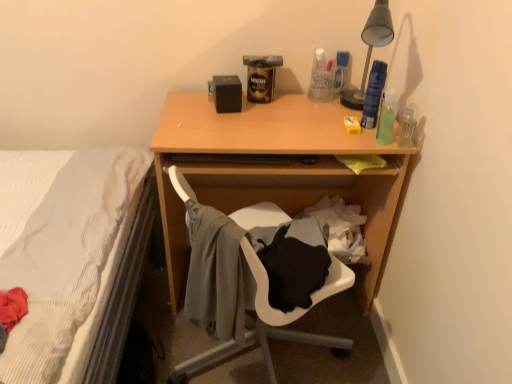
In order to click on vacant region to the left of translucent green bottle at right, arranged as the fourth bottle when viewed from the back in this screenshot , I will do `click(334, 127)`.